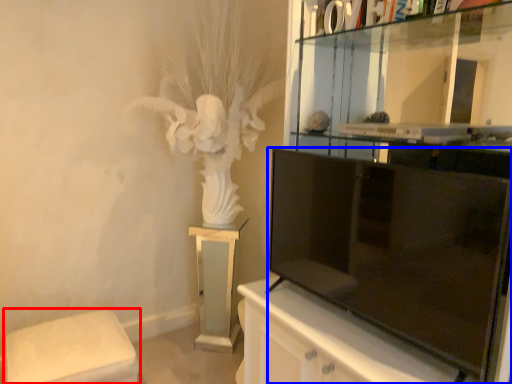
Question: Among these objects, which one is nearest to the camera, furniture (highlighted by a red box) or television (highlighted by a blue box)?

Choices:
 (A) furniture
 (B) television

Answer: (B)